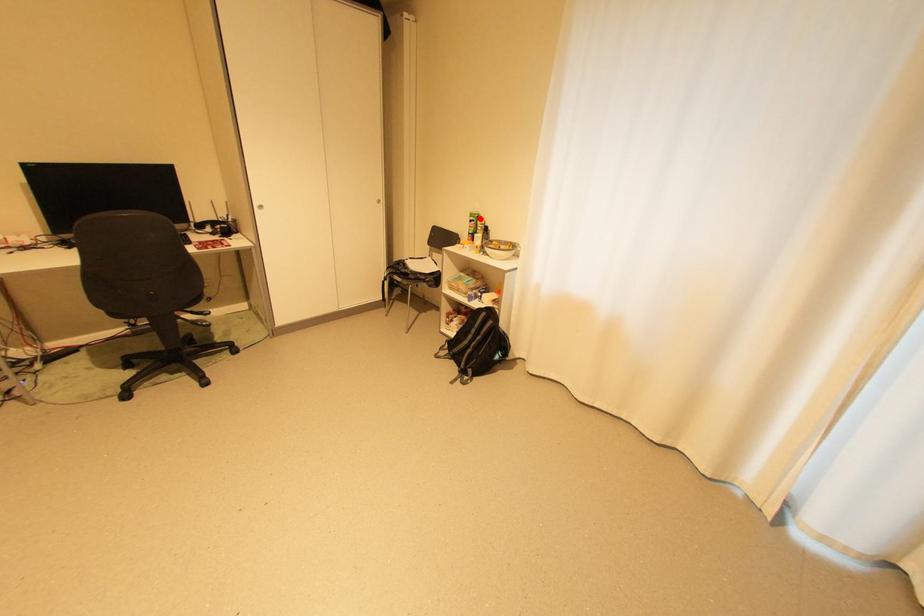
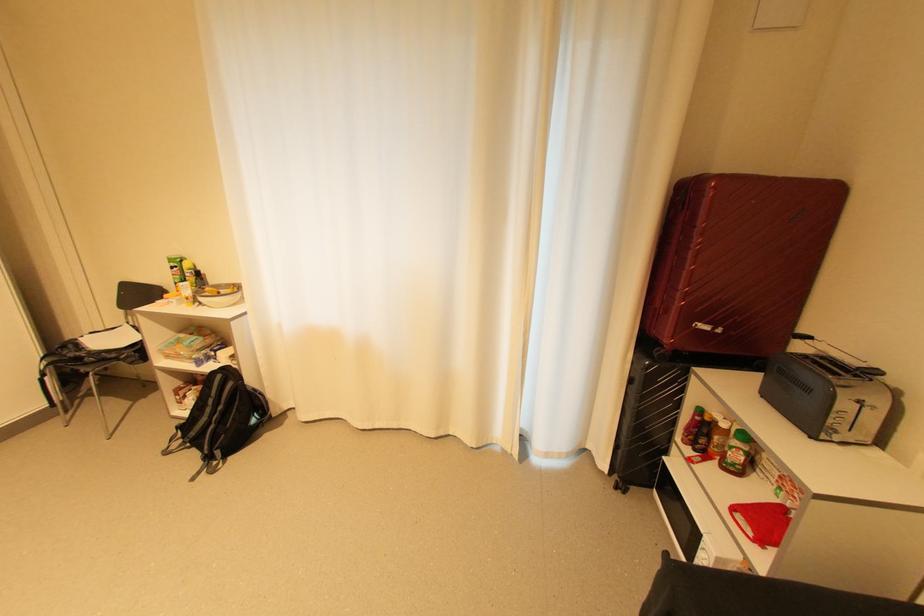
Find the pixel in the second image that matches the highlighted location in the first image.

(180, 265)